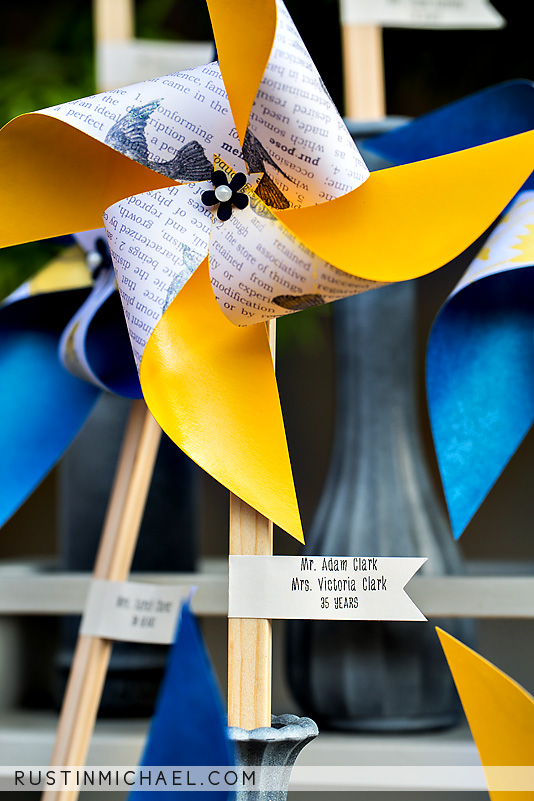
Find the location of a particular element. This screenshot has height=801, width=534. shelf is located at coordinates (370, 750).